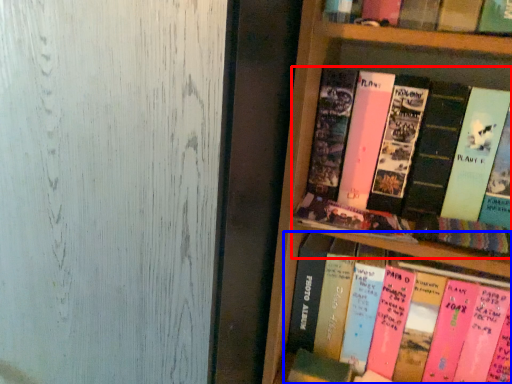
Question: Which object appears farthest to the camera in this image, book (highlighted by a red box) or book (highlighted by a blue box)?

Choices:
 (A) book
 (B) book

Answer: (B)